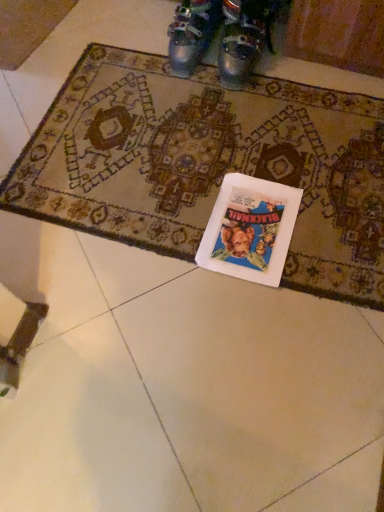
You are a GUI agent. You are given a task and a screenshot of the screen. Output one action in this format:
    pyautogui.click(x=<x>, y=<y>)
    Task: Click on the vacant space situated on the left part of white paper book at center
    
    Given the screenshot: What is the action you would take?
    pyautogui.click(x=160, y=209)